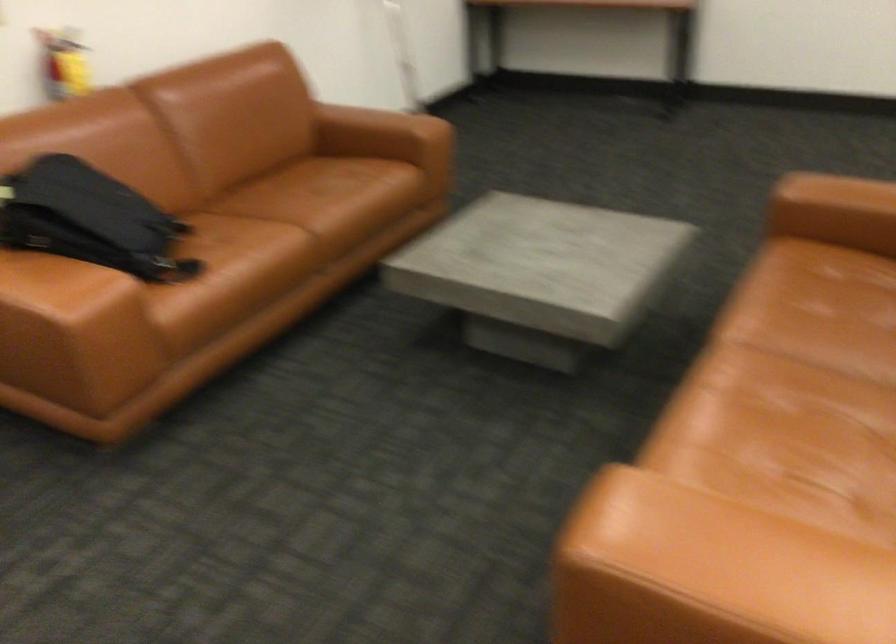
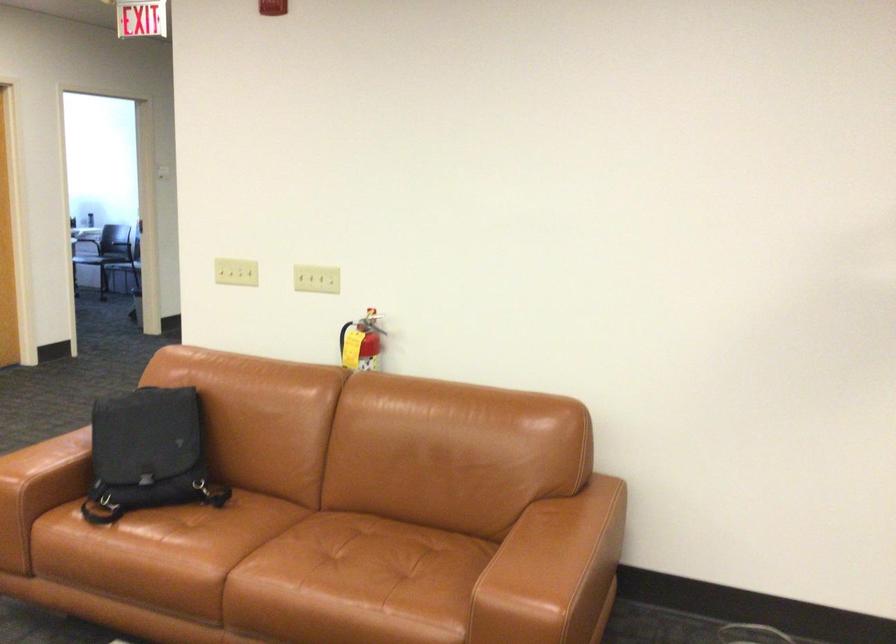
Where in the second image is the point corresponding to (x=341, y=180) from the first image?

(350, 574)